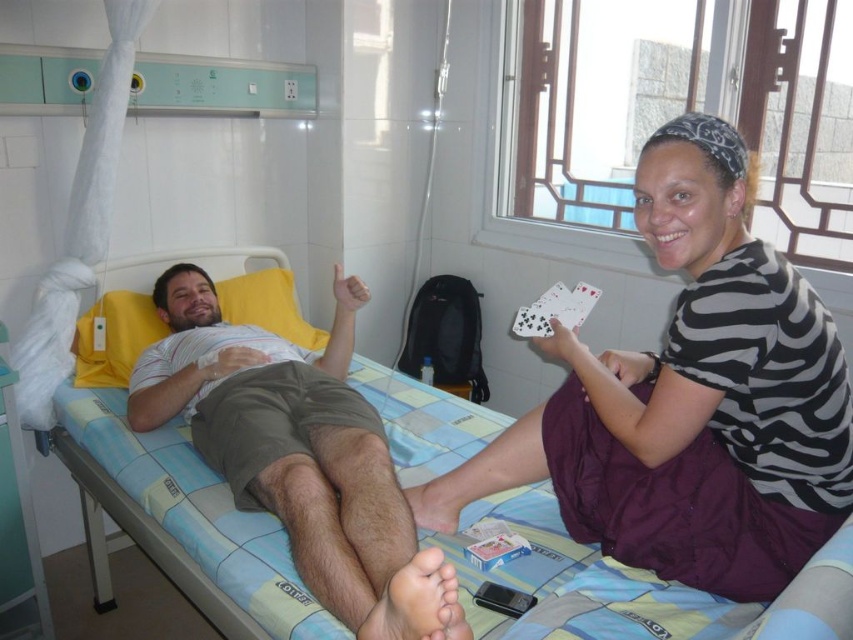
Question: Which object is farther from the camera taking this photo?

Choices:
 (A) matte khaki shorts at center
 (B) white paper cards at center

Answer: (B)

Question: Can you confirm if blue fabric hospital bed at center is positioned above matte khaki shorts at center?

Choices:
 (A) yes
 (B) no

Answer: (B)

Question: Is matte khaki shorts at center in front of white paper cards at center?

Choices:
 (A) yes
 (B) no

Answer: (A)

Question: From the image, what is the correct spatial relationship of blue fabric hospital bed at center in relation to matte khaki shorts at center?

Choices:
 (A) below
 (B) above

Answer: (A)

Question: Which object is farther from the camera taking this photo?

Choices:
 (A) blue fabric hospital bed at center
 (B) matte khaki shorts at center
 (C) white paper cards at center

Answer: (C)

Question: Which of these objects is positioned closest to the blue fabric hospital bed at center?

Choices:
 (A) zebra-patterned fabric at upper right
 (B) white paper cards at center
 (C) matte khaki shorts at center

Answer: (C)